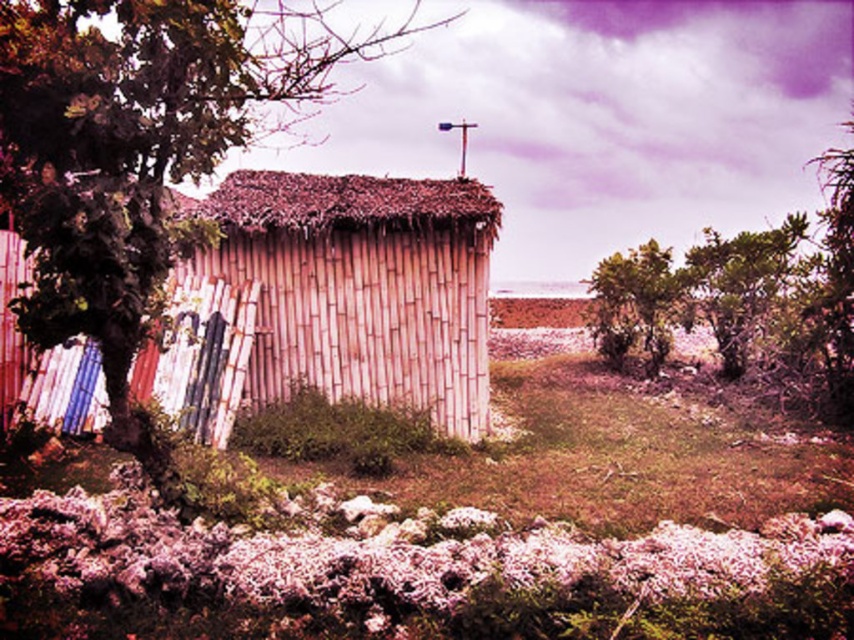
Question: Can you confirm if green leafy tree at left is positioned to the right of bamboo hut at center?

Choices:
 (A) no
 (B) yes

Answer: (A)

Question: In this image, where is green leafy tree at left located relative to bamboo hut at center?

Choices:
 (A) above
 (B) below

Answer: (A)

Question: Which point is farther to the camera?

Choices:
 (A) green leafy tree at upper right
 (B) wooden planks at left
 (C) green leafy tree at left

Answer: (A)

Question: Can you confirm if purple fuzzy flowers at lower center is wider than green leafy tree at upper right?

Choices:
 (A) no
 (B) yes

Answer: (A)

Question: Which object appears farthest from the camera in this image?

Choices:
 (A) purple fuzzy flowers at lower center
 (B) bamboo hut at center
 (C) green leafy tree at center

Answer: (C)

Question: Which of the following is the closest to the observer?

Choices:
 (A) bamboo hut at center
 (B) wooden planks at left
 (C) green leafy tree at center

Answer: (B)